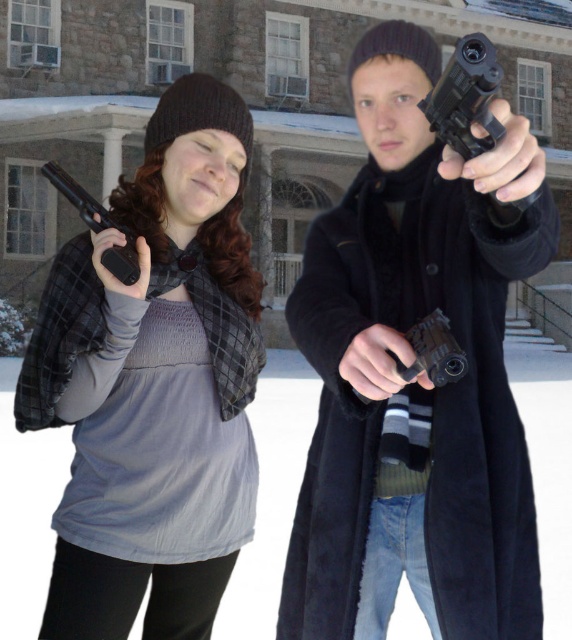
You are a security guard assessing the scene. You notice the matte black gun at left and the black plastic handgun at center. Which one is taller in height?

The matte black gun at left is taller than the black plastic handgun at center according to the description.

You are a security guard in the snowy area. You see the point marked at coordinates (154,385). What object is located at that point?

The point at coordinates (154,385) marks the matte black gun at left.